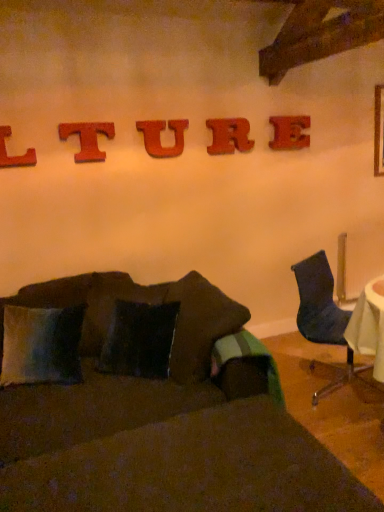
What do you see at coordinates (41, 345) in the screenshot?
I see `velvety blue pillow at lower left` at bounding box center [41, 345].

This screenshot has height=512, width=384. What do you see at coordinates (87, 139) in the screenshot? I see `red wood letter t at upper center, the 2th alphabet positioned from the left` at bounding box center [87, 139].

What is the approximate height of wooden letter r at upper center, acting as the fourth alphabet starting from the left?

12.44 inches.

At what (x,y) coordinates should I click in order to perform the action: click on wooden letter r at upper center, which ranks as the second alphabet in right-to-left order. Please return your answer as a coordinate pair (x, y). The image size is (384, 512). Looking at the image, I should click on (229, 136).

The image size is (384, 512). I want to click on velvety blue pillow at lower left, so click(41, 345).

Considering the sizes of wooden letter e at upper center, marked as the 1th alphabet in a right-to-left arrangement, and red wood u at center, which ranks as the 3th alphabet in right-to-left order, in the image, is wooden letter e at upper center, marked as the 1th alphabet in a right-to-left arrangement, bigger or smaller than red wood u at center, which ranks as the 3th alphabet in right-to-left order,?

In the image, wooden letter e at upper center, marked as the 1th alphabet in a right-to-left arrangement, appears to be larger than red wood u at center, which ranks as the 3th alphabet in right-to-left order.

From a real-world perspective, relative to red wood u at center, which ranks as the 3th alphabet in right-to-left order, is wooden letter e at upper center, positioned as the 5th alphabet in left-to-right order, vertically above or below?

From a real-world perspective, wooden letter e at upper center, positioned as the 5th alphabet in left-to-right order, is physically below red wood u at center, which ranks as the 3th alphabet in right-to-left order.

Is wooden letter e at upper center, positioned as the 5th alphabet in left-to-right order, completely or partially outside of red wood u at center, which is counted as the 3th alphabet, starting from the left?

Yes, wooden letter e at upper center, positioned as the 5th alphabet in left-to-right order, is located beyond the bounds of red wood u at center, which is counted as the 3th alphabet, starting from the left.

Does wooden letter e at upper center, marked as the 1th alphabet in a right-to-left arrangement, have a lesser width compared to red wood u at center, which is counted as the 3th alphabet, starting from the left?

No, wooden letter e at upper center, marked as the 1th alphabet in a right-to-left arrangement, is not thinner than red wood u at center, which is counted as the 3th alphabet, starting from the left.

Considering the sizes of objects velvet dark blue chair at right and red wood letter l at upper left, which is counted as the fifth alphabet, starting from the right, in the image provided, who is smaller, velvet dark blue chair at right or red wood letter l at upper left, which is counted as the fifth alphabet, starting from the right,?

With smaller size is red wood letter l at upper left, which is counted as the fifth alphabet, starting from the right.

In the scene shown: Is velvet dark blue chair at right in front of red wood letter l at upper left, which ranks as the 1th alphabet in left-to-right order?

Yes, velvet dark blue chair at right is closer to the viewer.

Is red wood letter l at upper left, which ranks as the 1th alphabet in left-to-right order, surrounded by velvet dark blue chair at right?

Actually, red wood letter l at upper left, which ranks as the 1th alphabet in left-to-right order, is outside velvet dark blue chair at right.

Would you say velvet dark brown couch at center is outside wooden letter r at upper center, which ranks as the second alphabet in right-to-left order?

Indeed, velvet dark brown couch at center is completely outside wooden letter r at upper center, which ranks as the second alphabet in right-to-left order.

Considering the sizes of objects velvet dark brown couch at center and wooden letter r at upper center, which ranks as the second alphabet in right-to-left order, in the image provided, who is thinner, velvet dark brown couch at center or wooden letter r at upper center, which ranks as the second alphabet in right-to-left order,?

With smaller width is wooden letter r at upper center, which ranks as the second alphabet in right-to-left order.

Which is more to the right, velvet dark brown couch at center or wooden letter r at upper center, which ranks as the second alphabet in right-to-left order?

Positioned to the right is wooden letter r at upper center, which ranks as the second alphabet in right-to-left order.

Is velvet dark brown couch at center taller or shorter than wooden letter r at upper center, acting as the fourth alphabet starting from the left?

Considering their sizes, velvet dark brown couch at center has more height than wooden letter r at upper center, acting as the fourth alphabet starting from the left.

Is red wood letter l at upper left, which is counted as the fifth alphabet, starting from the right, surrounded by red wood u at center, which ranks as the 3th alphabet in right-to-left order?

No, red wood letter l at upper left, which is counted as the fifth alphabet, starting from the right, is located outside of red wood u at center, which ranks as the 3th alphabet in right-to-left order.

Between red wood u at center, which is counted as the 3th alphabet, starting from the left, and red wood letter l at upper left, which is counted as the fifth alphabet, starting from the right, which one has less height?

With less height is red wood letter l at upper left, which is counted as the fifth alphabet, starting from the right.

From a real-world perspective, which is physically above, red wood u at center, which is counted as the 3th alphabet, starting from the left, or red wood letter l at upper left, which ranks as the 1th alphabet in left-to-right order?

red wood u at center, which is counted as the 3th alphabet, starting from the left, from a real-world perspective.

From the image's perspective, between red wood u at center, which ranks as the 3th alphabet in right-to-left order, and red wood letter l at upper left, which ranks as the 1th alphabet in left-to-right order, which one is located above?

red wood u at center, which ranks as the 3th alphabet in right-to-left order, appears higher in the image.

Find the location of a particular element. the 3rd alphabet counting from the left side of the wooden letter r at upper center, which ranks as the second alphabet in right-to-left order is located at coordinates (14, 156).

Which is farther, (5, 151) or (224, 129)?

The point (224, 129) is farther from the camera.

Measure the distance from red wood letter l at upper left, which ranks as the 1th alphabet in left-to-right order, to wooden letter r at upper center, which ranks as the second alphabet in right-to-left order.

red wood letter l at upper left, which ranks as the 1th alphabet in left-to-right order, and wooden letter r at upper center, which ranks as the second alphabet in right-to-left order, are 4.23 feet apart from each other.

Can you confirm if red wood letter l at upper left, which ranks as the 1th alphabet in left-to-right order, is wider than wooden letter r at upper center, acting as the fourth alphabet starting from the left?

Indeed, red wood letter l at upper left, which ranks as the 1th alphabet in left-to-right order, has a greater width compared to wooden letter r at upper center, acting as the fourth alphabet starting from the left.

From the image's perspective, would you say velvety blue pillow at lower left is shown under wooden letter r at upper center, acting as the fourth alphabet starting from the left?

Yes, from the image's perspective, velvety blue pillow at lower left is beneath wooden letter r at upper center, acting as the fourth alphabet starting from the left.

Is velvety blue pillow at lower left to the left of wooden letter r at upper center, which ranks as the second alphabet in right-to-left order, from the viewer's perspective?

Correct, you'll find velvety blue pillow at lower left to the left of wooden letter r at upper center, which ranks as the second alphabet in right-to-left order.

Is velvety blue pillow at lower left inside the boundaries of wooden letter r at upper center, which ranks as the second alphabet in right-to-left order, or outside?

velvety blue pillow at lower left is spatially situated outside wooden letter r at upper center, which ranks as the second alphabet in right-to-left order.

Is red wood letter t at upper center, the 2th alphabet positioned from the left, to the left or to the right of wooden letter r at upper center, which ranks as the second alphabet in right-to-left order, in the image?

red wood letter t at upper center, the 2th alphabet positioned from the left, is to the left of wooden letter r at upper center, which ranks as the second alphabet in right-to-left order.

Is red wood letter t at upper center, the fourth alphabet in the right-to-left sequence, smaller than wooden letter r at upper center, which ranks as the second alphabet in right-to-left order?

Correct, red wood letter t at upper center, the fourth alphabet in the right-to-left sequence, occupies less space than wooden letter r at upper center, which ranks as the second alphabet in right-to-left order.

Does point (96, 157) lie in front of point (248, 123)?

Yes.

How distant is red wood letter t at upper center, the fourth alphabet in the right-to-left sequence, from wooden letter r at upper center, which ranks as the second alphabet in right-to-left order?

red wood letter t at upper center, the fourth alphabet in the right-to-left sequence, and wooden letter r at upper center, which ranks as the second alphabet in right-to-left order, are 32.28 inches apart.

The image size is (384, 512). Identify the location of the 2nd alphabet in front of the wooden letter e at upper center, marked as the 1th alphabet in a right-to-left arrangement, starting your count from the anchor. (160, 137).

The width and height of the screenshot is (384, 512). In order to click on the 5th alphabet counting from the left side of the velvet dark blue chair at right in this screenshot , I will do `click(14, 156)`.

From the image, which object appears to be nearer to red wood letter t at upper center, the fourth alphabet in the right-to-left sequence, velvet dark blue chair at right or velvety blue pillow at lower left?

velvety blue pillow at lower left lies closer to red wood letter t at upper center, the fourth alphabet in the right-to-left sequence, than the other object.

Estimate the real-world distances between objects in this image. Which object is closer to wooden letter r at upper center, acting as the fourth alphabet starting from the left, velvety blue pillow at lower left or red wood u at center, which ranks as the 3th alphabet in right-to-left order?

red wood u at center, which ranks as the 3th alphabet in right-to-left order, lies closer to wooden letter r at upper center, acting as the fourth alphabet starting from the left, than the other object.

Looking at the image, which one is located further to velvet dark brown couch at center, velvet dark blue chair at right or velvety blue pillow at lower left?

velvet dark blue chair at right is positioned further to the anchor velvet dark brown couch at center.

From the image, which object appears to be nearer to velvety blue pillow at lower left, red wood letter t at upper center, the fourth alphabet in the right-to-left sequence, or wooden letter r at upper center, acting as the fourth alphabet starting from the left?

red wood letter t at upper center, the fourth alphabet in the right-to-left sequence, is positioned closer to the anchor velvety blue pillow at lower left.

Which object lies further to the anchor point velvety blue pillow at lower left, wooden letter e at upper center, positioned as the 5th alphabet in left-to-right order, or red wood letter l at upper left, which ranks as the 1th alphabet in left-to-right order?

Based on the image, wooden letter e at upper center, positioned as the 5th alphabet in left-to-right order, appears to be further to velvety blue pillow at lower left.

Considering their positions, is red wood u at center, which ranks as the 3th alphabet in right-to-left order, positioned further to red wood letter t at upper center, the 2th alphabet positioned from the left, than velvety blue pillow at lower left?

velvety blue pillow at lower left is further to red wood letter t at upper center, the 2th alphabet positioned from the left.

Looking at the image, which one is located closer to wooden letter r at upper center, which ranks as the second alphabet in right-to-left order, velvety blue pillow at lower left or red wood letter l at upper left, which ranks as the 1th alphabet in left-to-right order?

red wood letter l at upper left, which ranks as the 1th alphabet in left-to-right order, is positioned closer to the anchor wooden letter r at upper center, which ranks as the second alphabet in right-to-left order.

When comparing their distances from velvety blue pillow at lower left, does red wood letter t at upper center, the fourth alphabet in the right-to-left sequence, or velvet dark brown couch at center seem closer?

velvet dark brown couch at center is closer to velvety blue pillow at lower left.

The height and width of the screenshot is (512, 384). Identify the location of pillow between wooden letter r at upper center, which ranks as the second alphabet in right-to-left order, and velvet dark brown couch at center from top to bottom. (41, 345).

At what (x,y) coordinates should I click in order to perform the action: click on studio couch located between velvety blue pillow at lower left and wooden letter e at upper center, marked as the 1th alphabet in a right-to-left arrangement, in the left-right direction. Please return your answer as a coordinate pair (x, y). Looking at the image, I should click on (159, 414).

The width and height of the screenshot is (384, 512). What are the coordinates of `alphabet situated between red wood letter t at upper center, the 2th alphabet positioned from the left, and wooden letter r at upper center, which ranks as the second alphabet in right-to-left order, from left to right` in the screenshot? It's located at (160, 137).

I want to click on studio couch between red wood letter t at upper center, the 2th alphabet positioned from the left, and velvet dark blue chair at right from left to right, so click(159, 414).